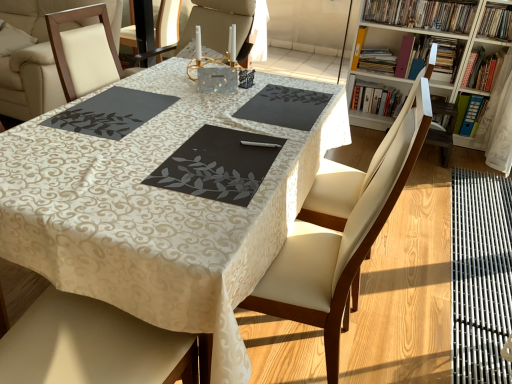
You are a GUI agent. You are given a task and a screenshot of the screen. Output one action in this format:
    pyautogui.click(x=<x>, y=<y>)
    Task: Click on the matte black placemat at center
    
    Given the screenshot: What is the action you would take?
    pyautogui.click(x=158, y=211)

What do you see at coordinates (111, 113) in the screenshot? I see `dark gray matte placemat at center, which appears as the 1th place mat when viewed from the left` at bounding box center [111, 113].

What do you see at coordinates (285, 107) in the screenshot? Image resolution: width=512 pixels, height=384 pixels. I see `black matte placemat at center, the 1th place mat when ordered from right to left` at bounding box center [285, 107].

Locate an element on the screen. hardcover books at upper right, marked as the third book in a left-to-right arrangement is located at coordinates (374, 98).

Is blue plastic folder at upper right, positioned as the seventh book in left-to-right order, to the left or to the right of matte purple book at upper right, which is the sixth book from right to left, in the image?

Based on their positions, blue plastic folder at upper right, positioned as the seventh book in left-to-right order, is located to the right of matte purple book at upper right, which is the sixth book from right to left.

From the image's perspective, between blue plastic folder at upper right, marked as the 3th book in a right-to-left arrangement, and matte purple book at upper right, which is the sixth book from right to left, which one is located above?

matte purple book at upper right, which is the sixth book from right to left, from the image's perspective.

In the scene shown: Would you say blue plastic folder at upper right, marked as the 3th book in a right-to-left arrangement, contains matte purple book at upper right, positioned as the 4th book in left-to-right order?

Actually, matte purple book at upper right, positioned as the 4th book in left-to-right order, is outside blue plastic folder at upper right, marked as the 3th book in a right-to-left arrangement.

Does hardcover book at upper right, which is the eighth book in right-to-left order, have a greater height compared to dark gray matte placemat at center, which appears as the 1th place mat when viewed from the left?

Yes.

Does hardcover book at upper right, which is the eighth book in right-to-left order, turn towards dark gray matte placemat at center, which appears as the 1th place mat when viewed from the left?

Yes, hardcover book at upper right, which is the eighth book in right-to-left order, is turned towards dark gray matte placemat at center, which appears as the 1th place mat when viewed from the left.

Are hardcover book at upper right, acting as the 2th book starting from the left, and dark gray matte placemat at center, the third place mat positioned from the right, far apart?

Indeed, hardcover book at upper right, acting as the 2th book starting from the left, is not near dark gray matte placemat at center, the third place mat positioned from the right.

Which object is wider, hardcover book at upper right, which is the eighth book in right-to-left order, or dark gray matte placemat at center, the third place mat positioned from the right?

dark gray matte placemat at center, the third place mat positioned from the right.

Between hardcover books at upper right, marked as the third book in a left-to-right arrangement, and hardcover book at upper right, which is the eighth book in right-to-left order, which one has larger size?

With larger size is hardcover book at upper right, which is the eighth book in right-to-left order.

Does hardcover books at upper right, the 7th book from the right, lie behind hardcover book at upper right, which is the eighth book in right-to-left order?

Yes, it is.

From the picture: Are hardcover books at upper right, marked as the third book in a left-to-right arrangement, and hardcover book at upper right, which is the eighth book in right-to-left order, beside each other?

No, hardcover books at upper right, marked as the third book in a left-to-right arrangement, is not in contact with hardcover book at upper right, which is the eighth book in right-to-left order.

Can you confirm if hardcover books at upper right, the 7th book from the right, is positioned to the right of hardcover book at upper right, acting as the 2th book starting from the left?

Indeed, hardcover books at upper right, the 7th book from the right, is positioned on the right side of hardcover book at upper right, acting as the 2th book starting from the left.

Is hardcover book at upper right, which is the eighth book in right-to-left order, bigger than matte black placemat at center?

No.

Is hardcover book at upper right, which is the eighth book in right-to-left order, facing away from matte black placemat at center?

hardcover book at upper right, which is the eighth book in right-to-left order, does not have its back to matte black placemat at center.

Which is closer, (358, 52) or (292, 191)?

Positioned in front is point (292, 191).

Considering the sizes of hardcover book at upper right, acting as the 2th book starting from the left, and matte black placemat at center in the image, is hardcover book at upper right, acting as the 2th book starting from the left, wider or thinner than matte black placemat at center?

In the image, hardcover book at upper right, acting as the 2th book starting from the left, appears to be more narrow than matte black placemat at center.

Between hardcover books at upper right, the 7th book from the right, and black matte placemat at center, the 1th place mat when ordered from right to left, which one has less height?

With less height is black matte placemat at center, the 1th place mat when ordered from right to left.

How distant is hardcover books at upper right, marked as the third book in a left-to-right arrangement, from black matte placemat at center, the 1th place mat when ordered from right to left?

6.34 feet.

Is hardcover books at upper right, the 7th book from the right, oriented towards black matte placemat at center, the 1th place mat when ordered from right to left?

Yes, hardcover books at upper right, the 7th book from the right, is facing black matte placemat at center, the 1th place mat when ordered from right to left.

Considering the relative sizes of hardcover books at upper right, the 7th book from the right, and black matte placemat at center, positioned as the third place mat in left-to-right order, in the image provided, is hardcover books at upper right, the 7th book from the right, bigger than black matte placemat at center, positioned as the third place mat in left-to-right order,?

Yes.

Is the depth of wooden bookcase at upper right greater than that of hardcover book at upper right, which appears as the fourth book when viewed from the right?

No.

Between wooden bookcase at upper right and hardcover book at upper right, which appears as the fourth book when viewed from the right, which one has smaller size?

With smaller size is hardcover book at upper right, which appears as the fourth book when viewed from the right.

The image size is (512, 384). What are the coordinates of `the 1st book counting from the right side of the wooden bookcase at upper right` in the screenshot? It's located at (443, 57).

Would you say black matte place mat at center, which appears as the second place mat when viewed from the right, is inside or outside yellow paper at upper right, placed as the 9th book when sorted from right to left?

black matte place mat at center, which appears as the second place mat when viewed from the right, is spatially situated outside yellow paper at upper right, placed as the 9th book when sorted from right to left.

What's the angular difference between black matte place mat at center, which appears as the second place mat when viewed from the right, and yellow paper at upper right, placed as the 9th book when sorted from right to left,'s facing directions?

The angular difference between black matte place mat at center, which appears as the second place mat when viewed from the right, and yellow paper at upper right, placed as the 9th book when sorted from right to left, is 86.7 degrees.

From a real-world perspective, which object stands above the other?

black matte place mat at center, the second place mat from the left.

I want to click on book that is the 5th object located below the matte purple book at upper right, which is the sixth book from right to left (from the image's perspective), so click(x=469, y=112).

Starting from the dark gray matte placemat at center, the third place mat positioned from the right, which book is the 2nd one to the right? Please provide its 2D coordinates.

[(376, 60)]

From the image, which object appears to be farther from hardcover books at upper right, the fifth book from the right, hardcover books at upper right, marked as the third book in a left-to-right arrangement, or blue plastic folder at upper right, positioned as the seventh book in left-to-right order?

blue plastic folder at upper right, positioned as the seventh book in left-to-right order.

From the image, which object appears to be farther from hardcover books at upper right, marked as the third book in a left-to-right arrangement, hardcover book at upper right, which is the second book from right to left, or black matte placemat at center, positioned as the third place mat in left-to-right order?

The object further to hardcover books at upper right, marked as the third book in a left-to-right arrangement, is black matte placemat at center, positioned as the third place mat in left-to-right order.

From the image, which object appears to be nearer to dark gray matte placemat at center, the third place mat positioned from the right, hardcover book at upper right, acting as the 2th book starting from the left, or hardcover books at upper right, the 7th book from the right?

Based on the image, hardcover book at upper right, acting as the 2th book starting from the left, appears to be nearer to dark gray matte placemat at center, the third place mat positioned from the right.

When comparing their distances from hardcover book at upper right, arranged as the eighth book when viewed from the left, does matte black placemat at center or black matte placemat at center, positioned as the third place mat in left-to-right order, seem further?

matte black placemat at center lies further to hardcover book at upper right, arranged as the eighth book when viewed from the left, than the other object.

Based on their spatial positions, is wooden bookcase at upper right or hardcover books at upper right, the 7th book from the right, further from hardcover book at upper right, which is the eighth book in right-to-left order?

Based on the image, wooden bookcase at upper right appears to be further to hardcover book at upper right, which is the eighth book in right-to-left order.

In the scene shown: Considering their positions, is matte black placemat at center positioned further to black matte placemat at center, the 1th place mat when ordered from right to left, than leather seat at center?

leather seat at center is further to black matte placemat at center, the 1th place mat when ordered from right to left.

Which object lies nearer to the anchor point hardcover book at upper right, the first book viewed from the right, hardcover book at upper right, which is the second book from right to left, or hardcover book at upper right, which appears as the fourth book when viewed from the right?

The object closer to hardcover book at upper right, the first book viewed from the right, is hardcover book at upper right, which is the second book from right to left.

From the image, which object appears to be nearer to hardcover book at upper right, which appears as the fourth book when viewed from the right, matte black placemat at center or black matte place mat at center, the second place mat from the left?

The object closer to hardcover book at upper right, which appears as the fourth book when viewed from the right, is black matte place mat at center, the second place mat from the left.

Find the location of a particular element. The image size is (512, 384). bookcase positioned between black matte place mat at center, the second place mat from the left, and hardcover book at upper right, which is the eighth book in right-to-left order, from near to far is located at coordinates (457, 67).

Find the location of a particular element. The height and width of the screenshot is (384, 512). bookcase between black matte place mat at center, the second place mat from the left, and hardcover book at upper right, which appears as the fourth book when viewed from the right, along the z-axis is located at coordinates click(457, 67).

Image resolution: width=512 pixels, height=384 pixels. I want to click on book between black matte place mat at center, which appears as the second place mat when viewed from the right, and hardcover book at upper right, arranged as the eighth book when viewed from the left, in the front-back direction, so click(x=496, y=22).

Find the location of `place mat positioned between dark gray matte placemat at center, the third place mat positioned from the right, and matte purple book at upper right, which is the sixth book from right to left, from near to far`. place mat positioned between dark gray matte placemat at center, the third place mat positioned from the right, and matte purple book at upper right, which is the sixth book from right to left, from near to far is located at coordinates (285, 107).